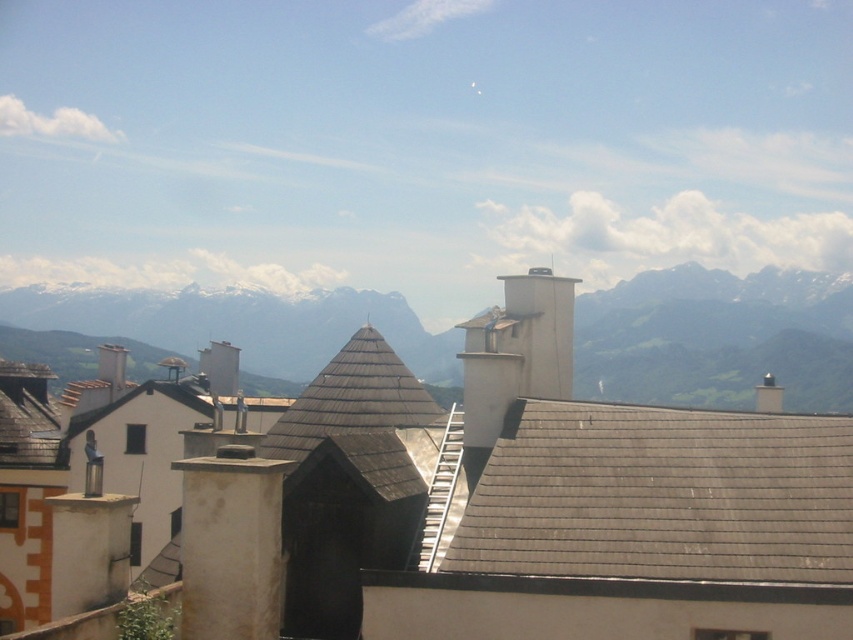
Question: Does green grassy mountain range at upper center appear on the right side of brown shingles at center?

Choices:
 (A) no
 (B) yes

Answer: (A)

Question: Which of the following is the farthest from the observer?

Choices:
 (A) (663, 433)
 (B) (137, 336)

Answer: (B)

Question: Which of these objects is positioned closest to the brown shingles at center?

Choices:
 (A) green grassy mountain range at upper center
 (B) gray shingles at upper right

Answer: (B)

Question: Which point appears farthest from the camera in this image?

Choices:
 (A) (723, 552)
 (B) (393, 419)
 (C) (640, 324)

Answer: (C)

Question: Is gray shingles at upper right to the right of green grassy mountain range at upper center from the viewer's perspective?

Choices:
 (A) yes
 (B) no

Answer: (A)

Question: Does gray shingles at upper right lie behind green grassy mountain range at upper center?

Choices:
 (A) no
 (B) yes

Answer: (A)